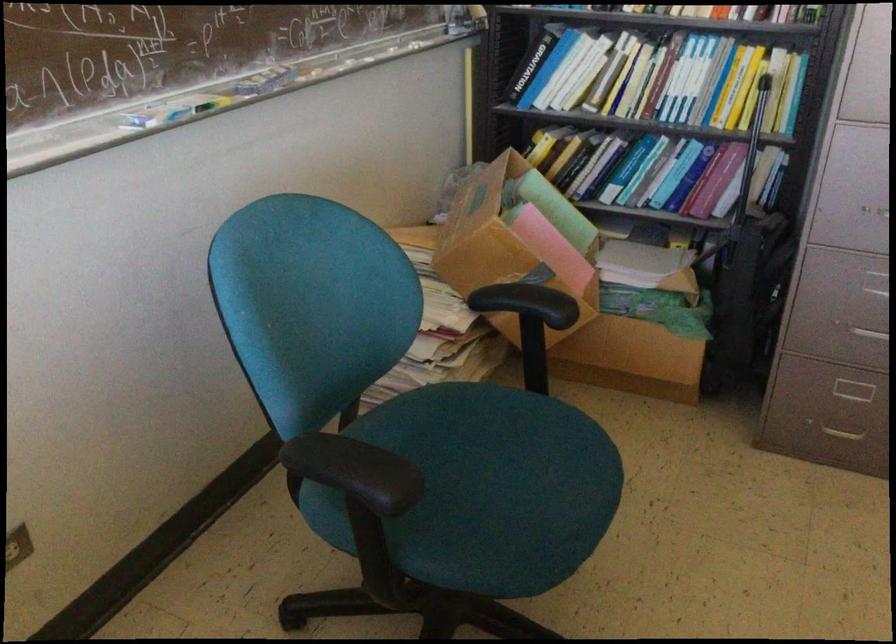
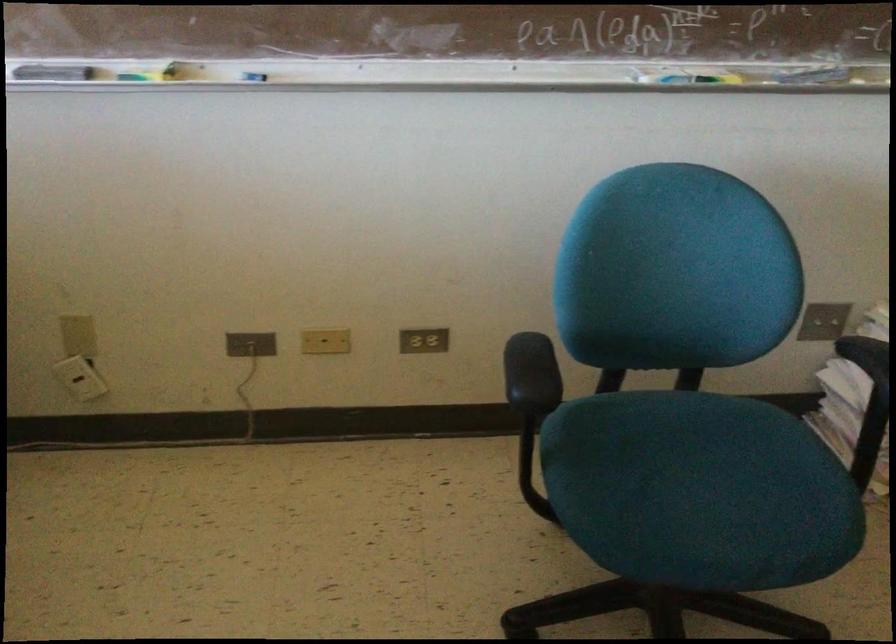
Where in the second image is the point corresponding to [383,478] from the first image?

(531, 374)